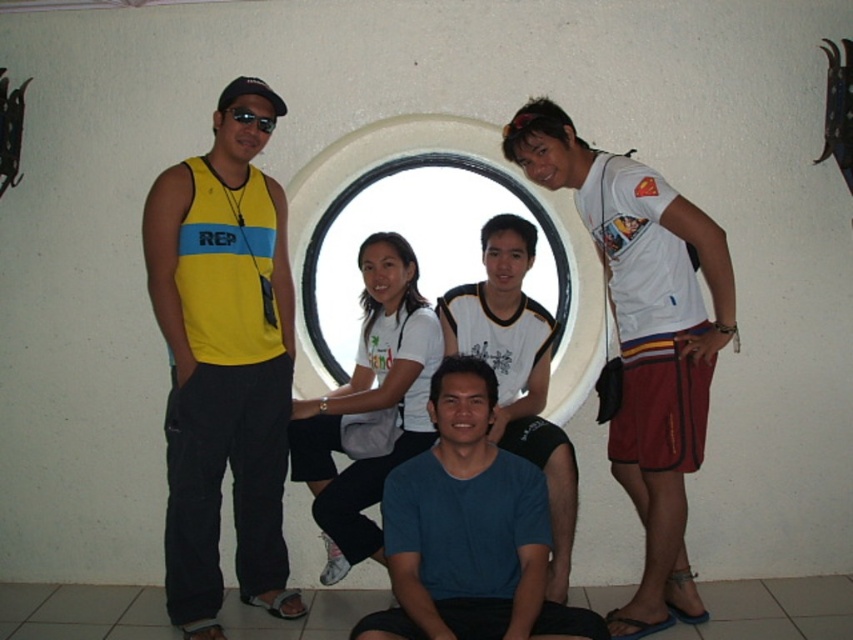
Can you confirm if blue matte shirt at center is positioned below blue cotton shirt at center?

Correct, blue matte shirt at center is located below blue cotton shirt at center.

Is blue matte shirt at center shorter than blue cotton shirt at center?

Yes, blue matte shirt at center is shorter than blue cotton shirt at center.

Is point (495, 486) less distant than point (515, 376)?

Yes, point (495, 486) is in front of point (515, 376).

In order to click on blue matte shirt at center in this screenshot , I will do `click(469, 531)`.

Is yellow fabric tank top at left above blue cotton shirt at center?

Correct, yellow fabric tank top at left is located above blue cotton shirt at center.

Is yellow fabric tank top at left to the right of blue cotton shirt at center from the viewer's perspective?

No, yellow fabric tank top at left is not to the right of blue cotton shirt at center.

Between point (253, 333) and point (548, 483), which one is positioned behind?

Positioned behind is point (253, 333).

The width and height of the screenshot is (853, 640). In order to click on yellow fabric tank top at left in this screenshot , I will do pyautogui.click(x=223, y=364).

Between yellow fabric tank top at left and white cotton shirt at center, which one appears on the right side from the viewer's perspective?

white cotton shirt at center

Does yellow fabric tank top at left have a lesser width compared to white cotton shirt at center?

Indeed, yellow fabric tank top at left has a lesser width compared to white cotton shirt at center.

Is point (271, 596) in front of point (401, 298)?

Yes, point (271, 596) is closer to viewer.

Identify the location of yellow fabric tank top at left. The width and height of the screenshot is (853, 640). (223, 364).